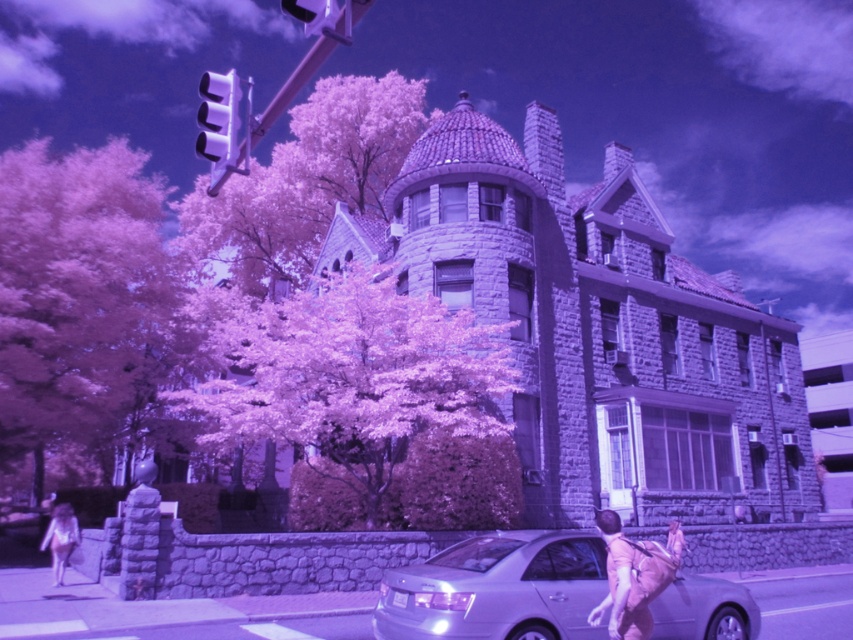
Question: Where is purple leafy tree at upper center located in relation to white cotton dress at lower left in the image?

Choices:
 (A) left
 (B) right

Answer: (A)

Question: Does purple leafy tree at center have a lesser width compared to white cotton dress at lower left?

Choices:
 (A) yes
 (B) no

Answer: (B)

Question: Observing the image, what is the correct spatial positioning of purple leafy tree at center in reference to purple leafy tree at upper center?

Choices:
 (A) below
 (B) above

Answer: (A)

Question: Which point is closer to the camera taking this photo?

Choices:
 (A) (474, 582)
 (B) (267, 307)
 (C) (242, 168)
 (D) (74, 252)

Answer: (A)

Question: Which point is closer to the camera?

Choices:
 (A) (611, 513)
 (B) (386, 275)
 (C) (51, 550)
 (D) (712, 612)

Answer: (A)

Question: Which point is closer to the camera taking this photo?

Choices:
 (A) (666, 572)
 (B) (675, 579)
 (C) (213, 77)

Answer: (A)